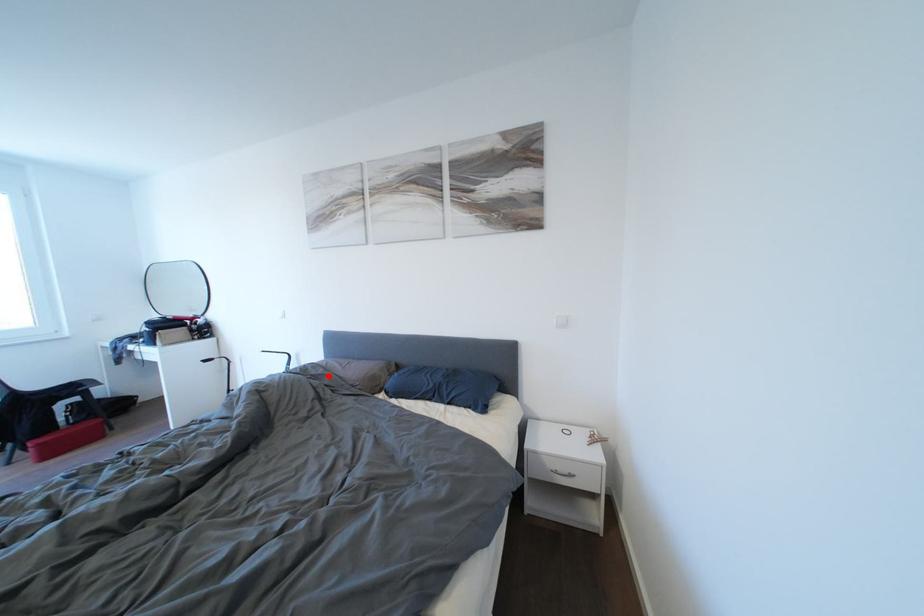
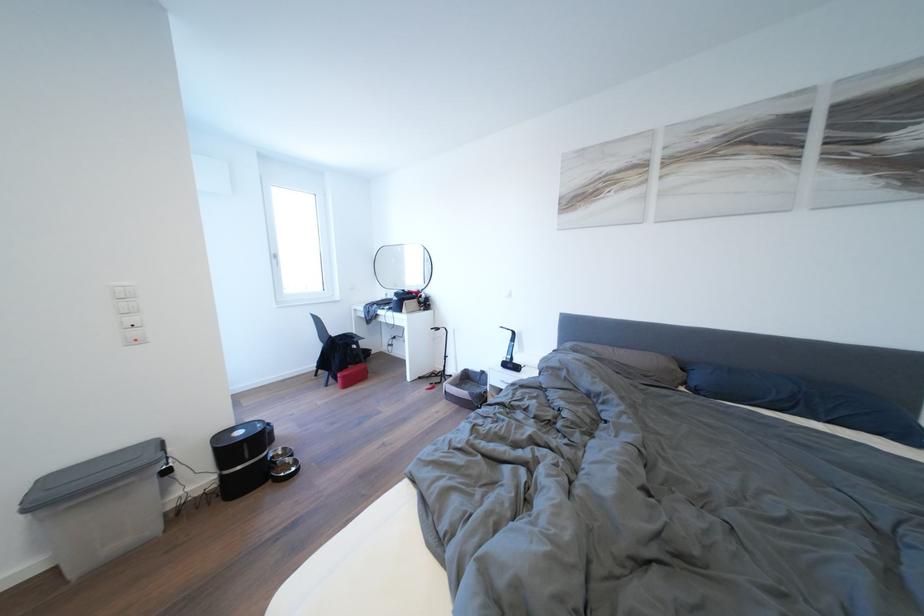
Where in the second image is the point corresponding to the highlighted location from the first image?

(602, 360)